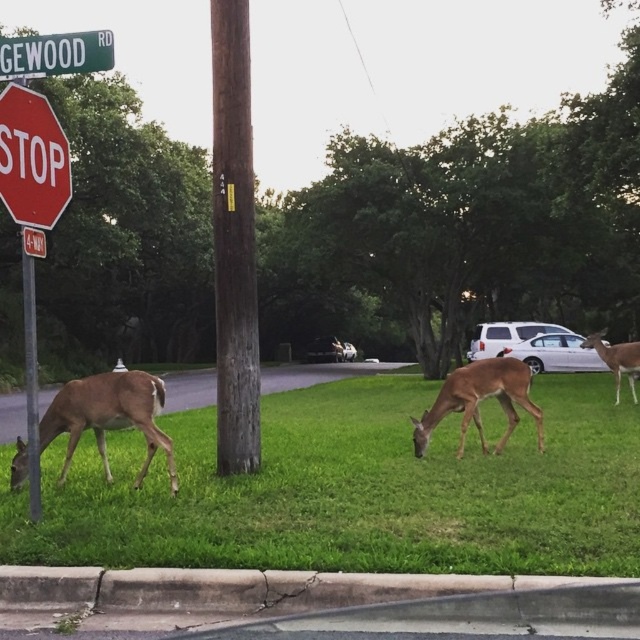
Is brown wooden pole at center above red stop sign at left?

No, brown wooden pole at center is not above red stop sign at left.

Is point (26, 282) farther from viewer compared to point (40, 236)?

That is False.

Where is `brown wooden pole at center`? brown wooden pole at center is located at coordinates (29, 380).

You are a GUI agent. You are given a task and a screenshot of the screen. Output one action in this format:
    pyautogui.click(x=<x>, y=<y>)
    Task: Click on the green grass at lower left
    Image resolution: width=640 pixels, height=640 pixels.
    Given the screenshot: What is the action you would take?
    pyautogui.click(x=355, y=490)

In order to click on green grass at lower left in this screenshot , I will do `click(355, 490)`.

Where is `green grass at lower left`? This screenshot has width=640, height=640. green grass at lower left is located at coordinates (355, 490).

Is the position of brown wood pole at center less distant than that of brown wooden pole at center?

No, brown wood pole at center is behind brown wooden pole at center.

Image resolution: width=640 pixels, height=640 pixels. What do you see at coordinates (234, 241) in the screenshot?
I see `brown wood pole at center` at bounding box center [234, 241].

This screenshot has height=640, width=640. I want to click on brown wood pole at center, so click(x=234, y=241).